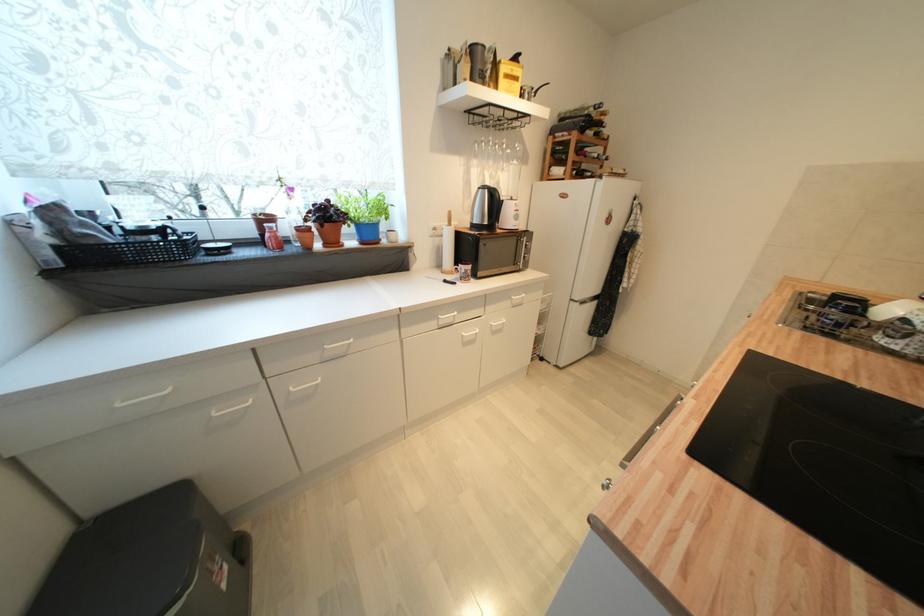
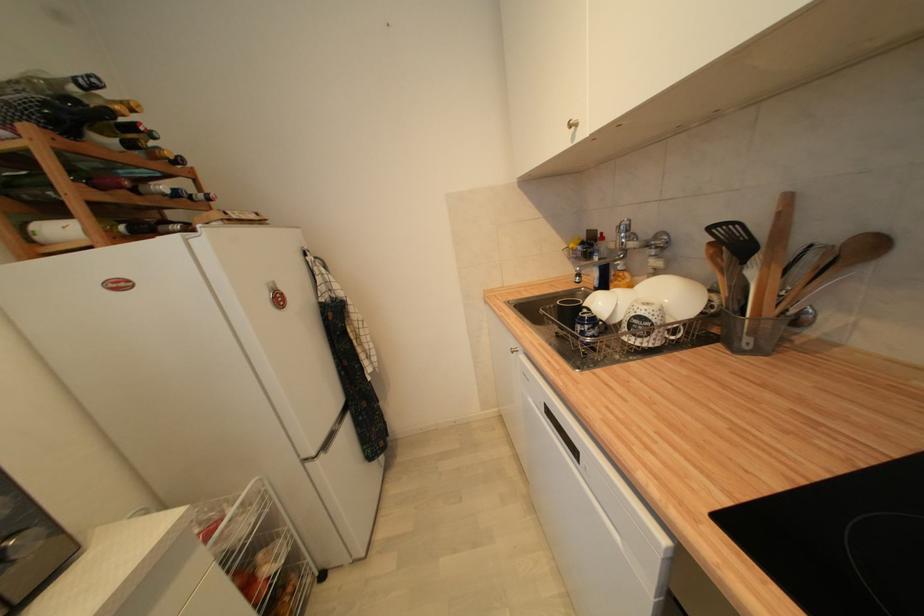
Find the pixel in the second image that matches the point at 612,161 in the first image.

(213, 200)